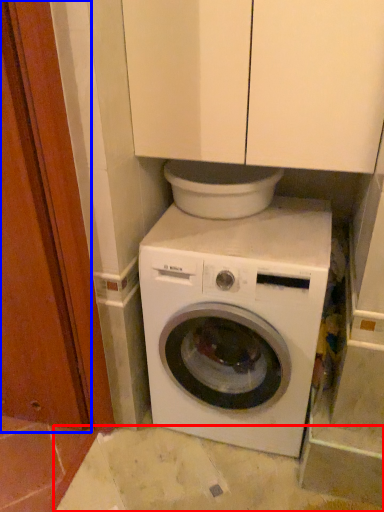
Question: Which object is closer to the camera taking this photo, concrete (highlighted by a red box) or screen door (highlighted by a blue box)?

Choices:
 (A) concrete
 (B) screen door

Answer: (B)